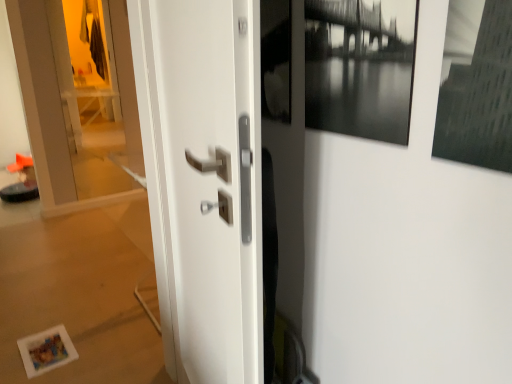
The height and width of the screenshot is (384, 512). I want to click on black matte picture frame at upper right, so tap(360, 67).

What is the approximate width of black matte picture frame at upper right?

black matte picture frame at upper right is 2.03 inches wide.

From the picture: What is the approximate width of transparent glass door at left?

transparent glass door at left is 0.77 inches wide.

The image size is (512, 384). Find the location of `white glossy door handle at center`. white glossy door handle at center is located at coordinates (209, 181).

Find the location of a particular element. The width and height of the screenshot is (512, 384). black matte picture frame at upper right is located at coordinates (360, 67).

What's the angular difference between white glossy door handle at center and black matte picture frame at upper right's facing directions?

10.5 degrees separate the facing orientations of white glossy door handle at center and black matte picture frame at upper right.

From the image's perspective, does white glossy door handle at center appear lower than black matte picture frame at upper right?

Yes, from the image's perspective, white glossy door handle at center is below black matte picture frame at upper right.

From a real-world perspective, is white glossy door handle at center on black matte picture frame at upper right?

No, from a real-world perspective, white glossy door handle at center is not above black matte picture frame at upper right.

Is white glossy door handle at center facing towards black matte picture frame at upper right?

No, white glossy door handle at center is not turned towards black matte picture frame at upper right.

Considering the sizes of transparent glass door at left and black matte picture frame at upper right in the image, is transparent glass door at left taller or shorter than black matte picture frame at upper right?

transparent glass door at left is taller than black matte picture frame at upper right.

Based on their sizes in the image, would you say transparent glass door at left is bigger or smaller than black matte picture frame at upper right?

Clearly, transparent glass door at left is larger in size than black matte picture frame at upper right.

From the image's perspective, which is below, transparent glass door at left or black matte picture frame at upper right?

black matte picture frame at upper right is shown below in the image.

Is transparent glass door at left inside or outside of black matte picture frame at upper right?

transparent glass door at left is outside black matte picture frame at upper right.

How different are the orientations of white glossy door handle at center and transparent glass door at left in degrees?

white glossy door handle at center and transparent glass door at left are facing 101 degrees away from each other.

Considering the relative sizes of white glossy door handle at center and transparent glass door at left in the image provided, is white glossy door handle at center wider than transparent glass door at left?

Indeed, white glossy door handle at center has a greater width compared to transparent glass door at left.

Is point (193, 70) closer to viewer compared to point (135, 182)?

Yes, it is.

In the scene shown: Is white glossy door handle at center to the left of transparent glass door at left from the viewer's perspective?

In fact, white glossy door handle at center is to the right of transparent glass door at left.

Is transparent glass door at left far away from white glossy door handle at center?

transparent glass door at left is far away from white glossy door handle at center.

Between transparent glass door at left and white glossy door handle at center, which one has less height?

Standing shorter between the two is white glossy door handle at center.

Is transparent glass door at left smaller than white glossy door handle at center?

Indeed, transparent glass door at left has a smaller size compared to white glossy door handle at center.

From a real-world perspective, is transparent glass door at left on top of white glossy door handle at center?

Indeed, from a real-world perspective, transparent glass door at left stands above white glossy door handle at center.

From a real-world perspective, is black matte picture frame at upper right over white glossy door handle at center?

Yes.

Between black matte picture frame at upper right and white glossy door handle at center, which one is positioned in front?

white glossy door handle at center is more forward.

Which object is positioned more to the right, black matte picture frame at upper right or white glossy door handle at center?

black matte picture frame at upper right.

In the image, there is a black matte picture frame at upper right. What are the coordinates of `door below it (from a real-world perspective)` in the screenshot? It's located at (209, 181).

Where is `picture frame that is in front of the transparent glass door at left`? Image resolution: width=512 pixels, height=384 pixels. picture frame that is in front of the transparent glass door at left is located at coordinates (360, 67).

Which of these two, black matte picture frame at upper right or transparent glass door at left, is wider?

black matte picture frame at upper right is wider.

Is black matte picture frame at upper right oriented towards transparent glass door at left?

No.

The image size is (512, 384). Identify the location of picture frame behind the white glossy door handle at center. (360, 67).

This screenshot has height=384, width=512. Find the location of `picture frame above the transparent glass door at left (from a real-world perspective)`. picture frame above the transparent glass door at left (from a real-world perspective) is located at coordinates pos(360,67).

When comparing their distances from white glossy door handle at center, does black matte picture frame at upper right or transparent glass door at left seem further?

Based on the image, transparent glass door at left appears to be further to white glossy door handle at center.

Looking at the image, which one is located further to black matte picture frame at upper right, white glossy door handle at center or transparent glass door at left?

transparent glass door at left is positioned further to the anchor black matte picture frame at upper right.

When comparing their distances from transparent glass door at left, does black matte picture frame at upper right or white glossy door handle at center seem closer?

white glossy door handle at center.

Based on their spatial positions, is transparent glass door at left or black matte picture frame at upper right closer to white glossy door handle at center?

black matte picture frame at upper right lies closer to white glossy door handle at center than the other object.

From the image, which object appears to be nearer to black matte picture frame at upper right, transparent glass door at left or white glossy door handle at center?

white glossy door handle at center is positioned closer to the anchor black matte picture frame at upper right.

Looking at the image, which one is located further to transparent glass door at left, white glossy door handle at center or black matte picture frame at upper right?

black matte picture frame at upper right lies further to transparent glass door at left than the other object.

Find the location of `picture frame between white glossy door handle at center and transparent glass door at left from front to back`. picture frame between white glossy door handle at center and transparent glass door at left from front to back is located at coordinates (360, 67).